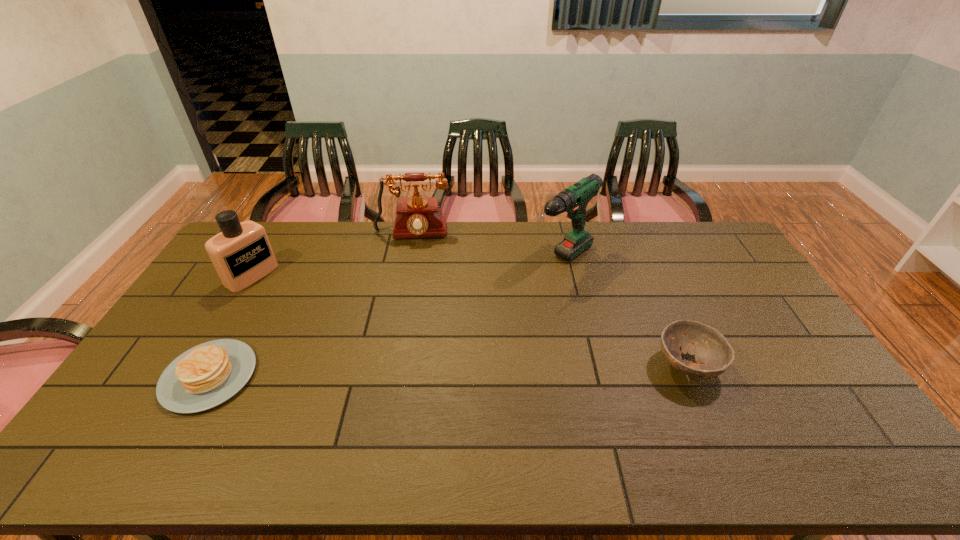
Where is `object that can be found as the second closest to the bowl`? object that can be found as the second closest to the bowl is located at coordinates (417, 217).

Select which object is the closest to the tallest object. Please provide its 2D coordinates. Your answer should be formatted as a tuple, i.e. [(x, y)], where the tuple contains the x and y coordinates of a point satisfying the conditions above.

[(713, 354)]

Where is `free space that satisfies the following two spatial constraints: 1. on the front side of the second shortest object; 2. on the left side of the second object from right to left`? The height and width of the screenshot is (540, 960). free space that satisfies the following two spatial constraints: 1. on the front side of the second shortest object; 2. on the left side of the second object from right to left is located at coordinates (583, 365).

Where is `free space that satisfies the following two spatial constraints: 1. on the front side of the perfume; 2. on the left side of the bowl`? The height and width of the screenshot is (540, 960). free space that satisfies the following two spatial constraints: 1. on the front side of the perfume; 2. on the left side of the bowl is located at coordinates (198, 365).

This screenshot has height=540, width=960. Identify the location of free space in the image that satisfies the following two spatial constraints: 1. on the back side of the pancake; 2. on the right side of the fourth object from left to right. (274, 261).